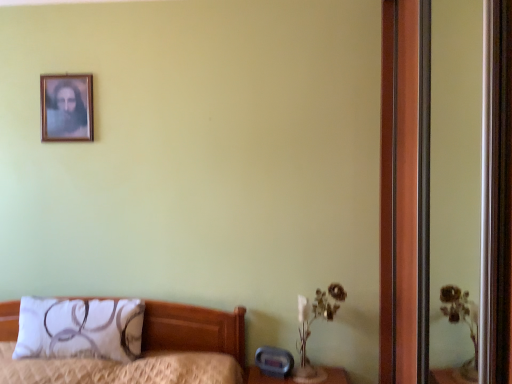
Locate an element on the screen. The image size is (512, 384). wooden picture frame at upper left is located at coordinates (67, 107).

Where is `white fabric pillow at lower left`? The height and width of the screenshot is (384, 512). white fabric pillow at lower left is located at coordinates (80, 329).

Where is `wooden picture frame at upper left`? This screenshot has width=512, height=384. wooden picture frame at upper left is located at coordinates (67, 107).

Is wooden picture frame at upper left positioned far away from white fabric pillow at lower left?

That's right, there is a large distance between wooden picture frame at upper left and white fabric pillow at lower left.

Considering the relative sizes of wooden picture frame at upper left and white fabric pillow at lower left in the image provided, is wooden picture frame at upper left taller than white fabric pillow at lower left?

Yes.

Considering the positions of point (66, 76) and point (41, 321), is point (66, 76) closer or farther from the camera than point (41, 321)?

Point (66, 76) is farther from the camera than point (41, 321).

Who is bigger, wooden picture frame at upper left or white fabric pillow at lower left?

Bigger between the two is white fabric pillow at lower left.

Is white fabric pillow at lower left closer to the viewer compared to wooden screen door at right?

No, white fabric pillow at lower left is behind wooden screen door at right.

Is white fabric pillow at lower left placed right next to wooden screen door at right?

No, white fabric pillow at lower left is not next to wooden screen door at right.

From the image's perspective, is white fabric pillow at lower left located beneath wooden screen door at right?

Yes, from the image's perspective, white fabric pillow at lower left is beneath wooden screen door at right.

Is white fabric pillow at lower left oriented towards wooden screen door at right?

No, white fabric pillow at lower left is not turned towards wooden screen door at right.

The height and width of the screenshot is (384, 512). I want to click on picture frame above the wooden screen door at right (from the image's perspective), so click(67, 107).

Considering the positions of objects wooden screen door at right and wooden picture frame at upper left in the image provided, who is behind, wooden screen door at right or wooden picture frame at upper left?

wooden picture frame at upper left is more distant.

Can you tell me how much wooden screen door at right and wooden picture frame at upper left differ in facing direction?

There is a 90.2-degree angle between the facing directions of wooden screen door at right and wooden picture frame at upper left.

Which is more to the left, wooden screen door at right or wooden picture frame at upper left?

wooden picture frame at upper left is more to the left.

Can you confirm if white fabric pillow at lower left is positioned to the right of wooden picture frame at upper left?

Correct, you'll find white fabric pillow at lower left to the right of wooden picture frame at upper left.

Does white fabric pillow at lower left turn towards wooden picture frame at upper left?

No, white fabric pillow at lower left is not facing towards wooden picture frame at upper left.

Is white fabric pillow at lower left positioned beyond the bounds of wooden picture frame at upper left?

Absolutely, white fabric pillow at lower left is external to wooden picture frame at upper left.

Considering the relative sizes of wooden picture frame at upper left and wooden screen door at right in the image provided, is wooden picture frame at upper left bigger than wooden screen door at right?

Actually, wooden picture frame at upper left might be smaller than wooden screen door at right.

Is wooden picture frame at upper left further to camera compared to wooden screen door at right?

Yes, it is behind wooden screen door at right.

Is wooden picture frame at upper left facing away from wooden screen door at right?

wooden picture frame at upper left is not turned away from wooden screen door at right.

From a real-world perspective, does wooden screen door at right stand above white fabric pillow at lower left?

Indeed, from a real-world perspective, wooden screen door at right stands above white fabric pillow at lower left.

Does wooden screen door at right have a lesser height compared to white fabric pillow at lower left?

Incorrect, the height of wooden screen door at right does not fall short of that of white fabric pillow at lower left.

Is wooden screen door at right placed right next to white fabric pillow at lower left?

No, wooden screen door at right is not beside white fabric pillow at lower left.

Does wooden screen door at right lie behind white fabric pillow at lower left?

No, wooden screen door at right is in front of white fabric pillow at lower left.

Identify the location of pillow lying below the wooden picture frame at upper left (from the image's perspective). This screenshot has width=512, height=384. (80, 329).

Find the location of `screen door above the white fabric pillow at lower left (from a real-world perspective)`. screen door above the white fabric pillow at lower left (from a real-world perspective) is located at coordinates (405, 191).

Based on their spatial positions, is white fabric pillow at lower left or wooden screen door at right closer to wooden picture frame at upper left?

white fabric pillow at lower left lies closer to wooden picture frame at upper left than the other object.

When comparing their distances from white fabric pillow at lower left, does wooden screen door at right or wooden picture frame at upper left seem further?

wooden screen door at right lies further to white fabric pillow at lower left than the other object.

Which object lies nearer to the anchor point white fabric pillow at lower left, wooden picture frame at upper left or wooden screen door at right?

wooden picture frame at upper left is positioned closer to the anchor white fabric pillow at lower left.

Which object lies nearer to the anchor point wooden screen door at right, white fabric pillow at lower left or wooden picture frame at upper left?

Based on the image, white fabric pillow at lower left appears to be nearer to wooden screen door at right.

Looking at the image, which one is located further to wooden screen door at right, wooden picture frame at upper left or white fabric pillow at lower left?

Based on the image, wooden picture frame at upper left appears to be further to wooden screen door at right.

When comparing their distances from wooden picture frame at upper left, does wooden screen door at right or white fabric pillow at lower left seem closer?

white fabric pillow at lower left.

At what (x,y) coordinates should I click in order to perform the action: click on pillow between wooden picture frame at upper left and wooden screen door at right in the horizontal direction. Please return your answer as a coordinate pair (x, y). This screenshot has width=512, height=384. Looking at the image, I should click on (80, 329).